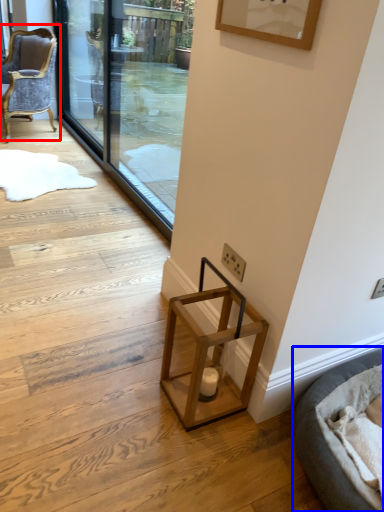
Question: Which of the following is the farthest to the observer, chair (highlighted by a red box) or cat bed (highlighted by a blue box)?

Choices:
 (A) chair
 (B) cat bed

Answer: (A)